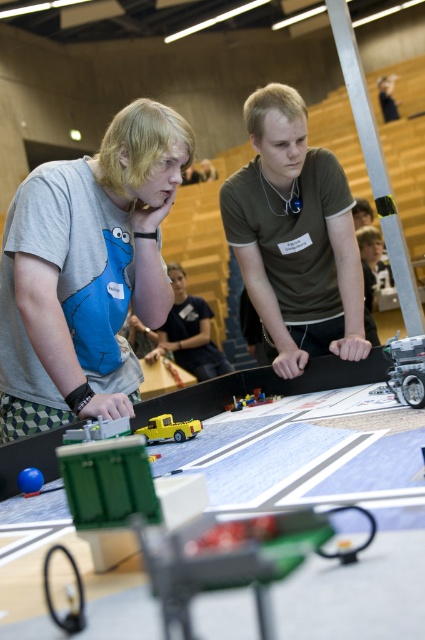
Which of these two, matte black shirt at center or yellow matte truck at center, stands taller?

With more height is matte black shirt at center.

Who is lower down, matte black shirt at center or yellow matte truck at center?

Positioned lower is yellow matte truck at center.

Which is behind, point (149, 358) or point (149, 429)?

Point (149, 358)

I want to click on matte black shirt at center, so click(189, 332).

At what (x,y) coordinates should I click in order to perform the action: click on matte gray shirt at center. Please return your answer as a coordinate pair (x, y). This screenshot has width=425, height=640. Looking at the image, I should click on (87, 272).

Which is in front, point (102, 269) or point (150, 435)?

Point (102, 269) is in front.

Is point (48, 352) positioned behind point (181, 432)?

No, (48, 352) is closer to viewer.

Find the location of a particular element. matte gray shirt at center is located at coordinates (87, 272).

Does point (198, 422) come behind point (271, 394)?

No, it is not.

Is yellow matte truck at center thinner than brick-like plastic toy at center?

Yes, yellow matte truck at center is thinner than brick-like plastic toy at center.

Between point (144, 433) and point (234, 404), which one is positioned in front?

Positioned in front is point (144, 433).

Where is `yellow matte truck at center`? The image size is (425, 640). yellow matte truck at center is located at coordinates (169, 428).